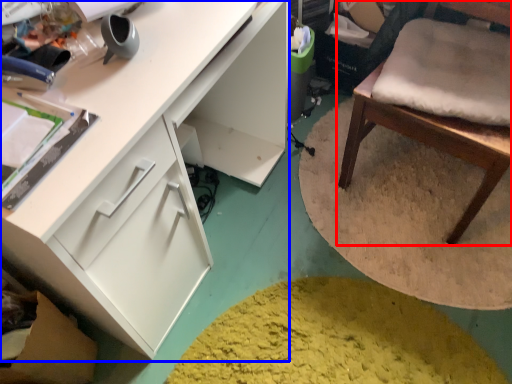
Question: Which of the following is the farthest to the observer, chair (highlighted by a red box) or cabinetry (highlighted by a blue box)?

Choices:
 (A) chair
 (B) cabinetry

Answer: (A)